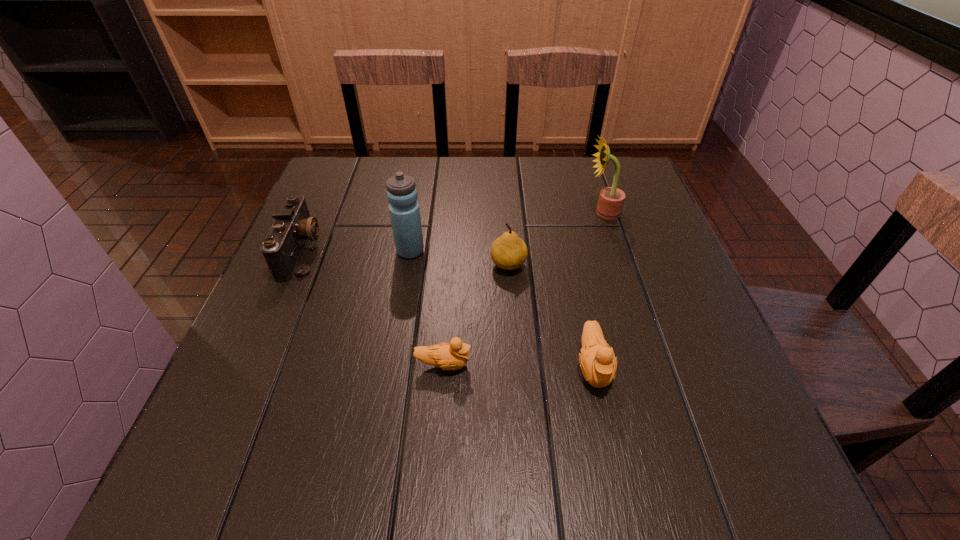
Please point a spot to add another duckling on the left. Please provide its 2D coordinates. Your answer should be formatted as a tuple, i.e. [(x, y)], where the tuple contains the x and y coordinates of a point satisfying the conditions above.

[(295, 363)]